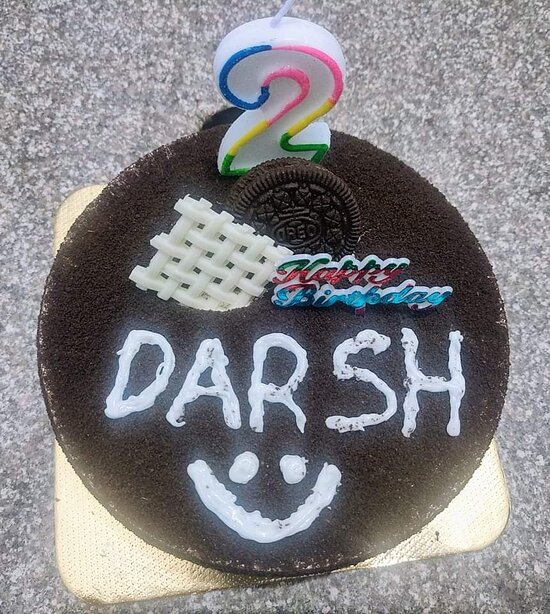
The image size is (550, 614). In order to click on countertop, granite in appearance in this screenshot , I will do `click(500, 227)`, `click(37, 235)`.